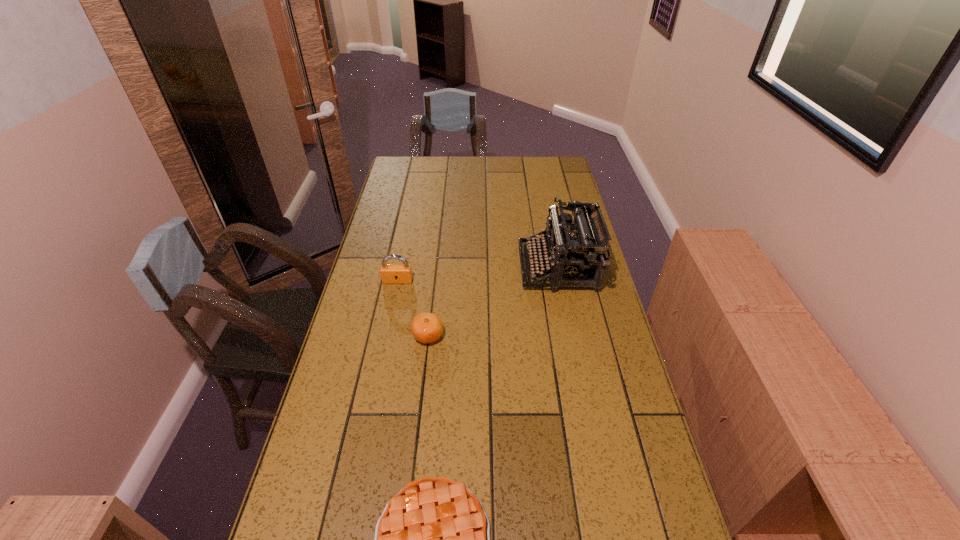
The image size is (960, 540). Find the location of `the rightmost object`. the rightmost object is located at coordinates (580, 255).

What are the coordinates of `the tallest object` in the screenshot? It's located at (580, 255).

Identify the location of padlock. (390, 273).

Identify the location of the third shortest object. (390, 273).

Where is `the second shortest object`? The image size is (960, 540). the second shortest object is located at coordinates (427, 327).

The height and width of the screenshot is (540, 960). Identify the location of clementine. (427, 327).

Locate an element on the screen. The height and width of the screenshot is (540, 960). vacant position located on the typing side of the typewriter is located at coordinates (466, 267).

Identify the location of blank space located on the typing side of the typewriter. The width and height of the screenshot is (960, 540). (466, 267).

What are the coordinates of `free region located on the typing side of the typewriter` in the screenshot? It's located at (420, 267).

You are a GUI agent. You are given a task and a screenshot of the screen. Output one action in this format:
    pyautogui.click(x=<x>, y=<y>)
    Task: Click on the free region located 0.110m to unlock the second tallest object from the front
    The image size is (960, 540).
    Given the screenshot: What is the action you would take?
    pyautogui.click(x=393, y=307)